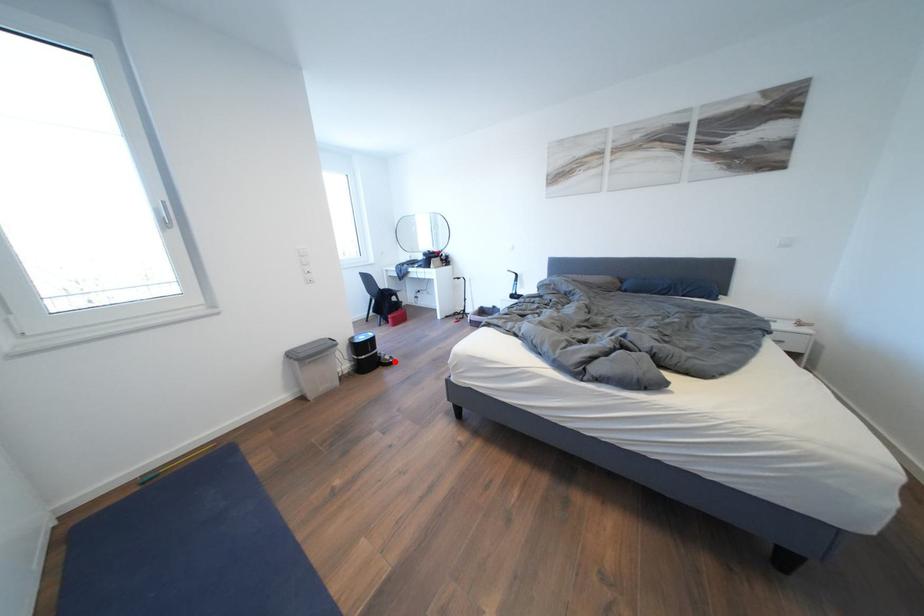
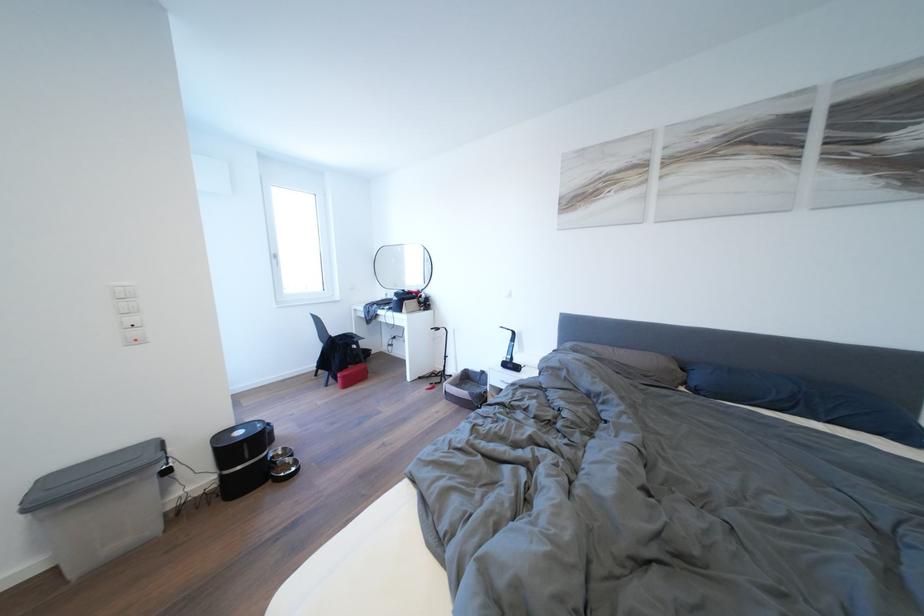
Question: I am providing you with two images of the same scene from different viewpoints. A red point is shown in image1. For the corresponding object point in image2, is it positioned nearer or farther from the camera?

Choices:
 (A) Nearer
 (B) Farther

Answer: (B)